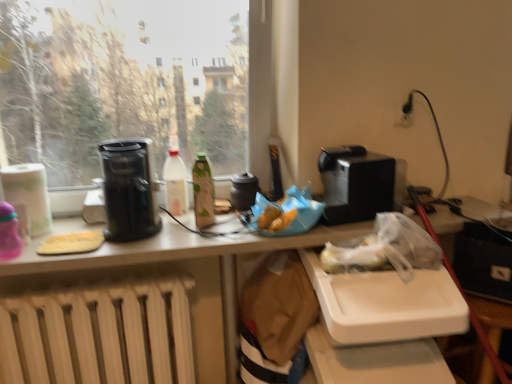
You are a GUI agent. You are given a task and a screenshot of the screen. Output one action in this format:
    pyautogui.click(x=<x>, y=<y>)
    Task: Click on the empty space that is ontop of black plastic coffee maker at left
    This screenshot has height=384, width=512.
    Given the screenshot: What is the action you would take?
    pos(125,141)